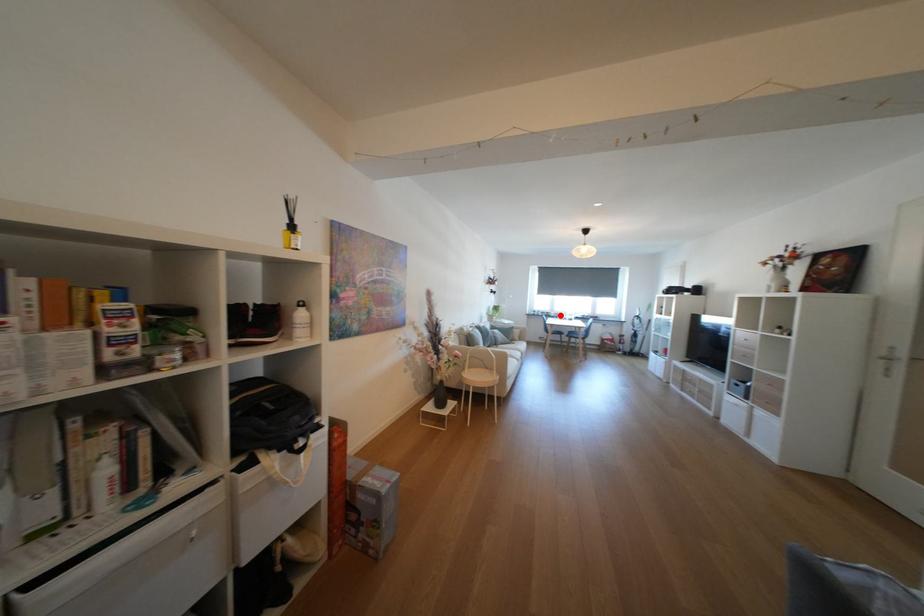
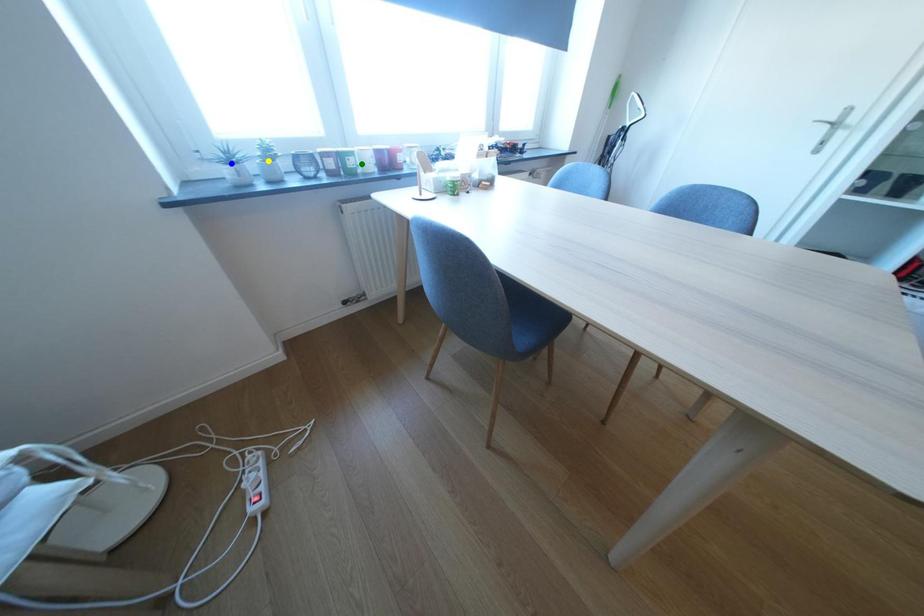
Question: I am providing you with two images of the same scene from different viewpoints. A red point is marked on the first image. You are given multiple points on the second image. Which mark in image 2 goes with the point in image 1?

Choices:
 (A) blue point
 (B) green point
 (C) yellow point

Answer: (B)